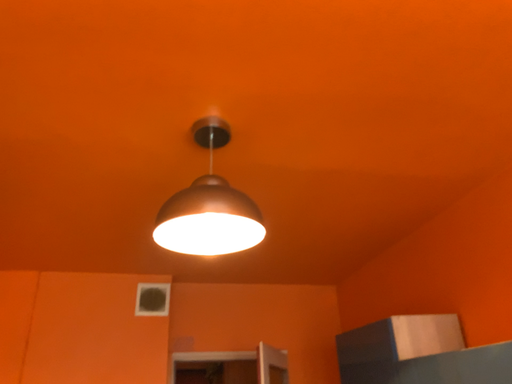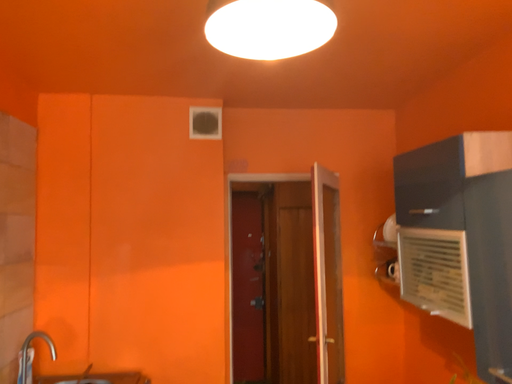
Question: How did the camera likely rotate when shooting the video?

Choices:
 (A) rotated upward
 (B) rotated downward

Answer: (B)